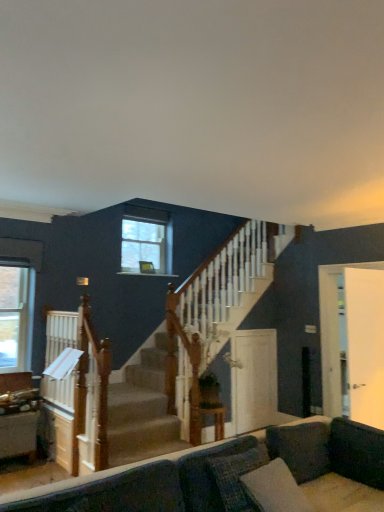
Question: Considering the positions of white glossy door at right, arranged as the first screen door when viewed from the right, and wooden table at center in the image, is white glossy door at right, arranged as the first screen door when viewed from the right, bigger or smaller than wooden table at center?

Choices:
 (A) small
 (B) big

Answer: (B)

Question: Would you say white glossy door at right, arranged as the first screen door when viewed from the right, is inside or outside wooden table at center?

Choices:
 (A) outside
 (B) inside

Answer: (A)

Question: Which object is positioned closest to the clear glass window at left, the 2th window positioned from the right?

Choices:
 (A) clear glass window at upper center, which appears as the 1th window when viewed from the right
 (B) dark gray fabric pillow at lower right
 (C) velvet dark gray couch at lower center
 (D) white glossy door at right, which is the 2th screen door from back to front
 (E) wooden table at center

Answer: (A)

Question: Considering the real-world distances, which object is farthest from the velvet dark gray couch at lower center?

Choices:
 (A) clear glass window at upper center, marked as the first window in a back-to-front arrangement
 (B) clear glass window at left, acting as the 2th window starting from the back
 (C) white glossy door at right, arranged as the first screen door when viewed from the right
 (D) dark gray fabric pillow at lower right
 (E) white glossy door at center, which is counted as the 1th screen door, starting from the left

Answer: (B)